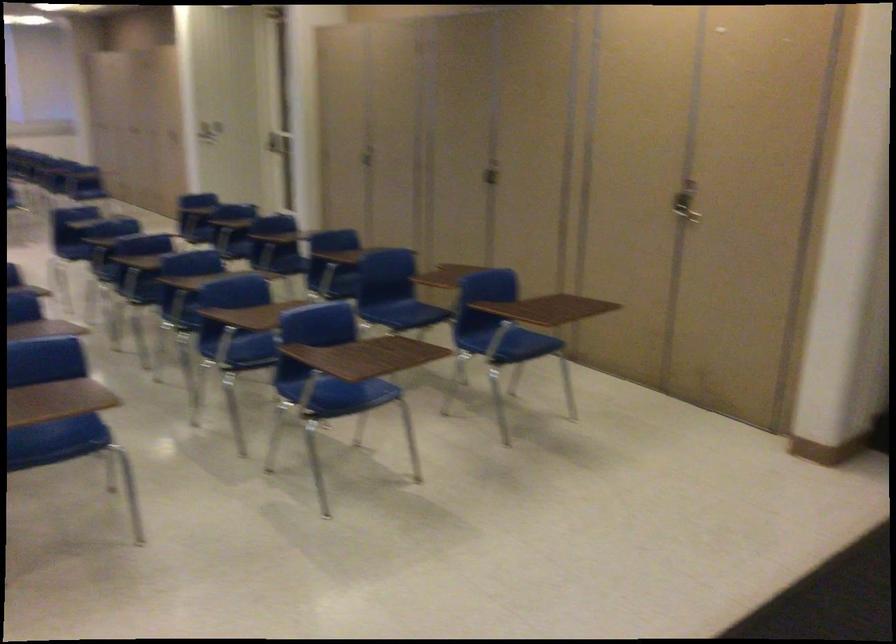
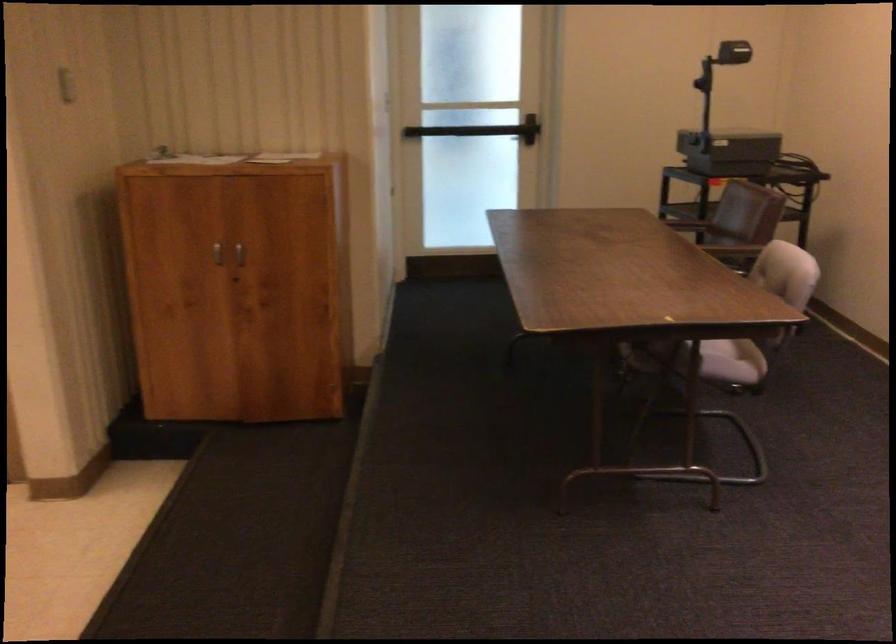
Question: The camera is either moving clockwise (left) or counter-clockwise (right) around the object. The first image is from the beginning of the video and the second image is from the end. Is the camera moving left or right when shooting the video?

Choices:
 (A) Left
 (B) Right

Answer: (A)